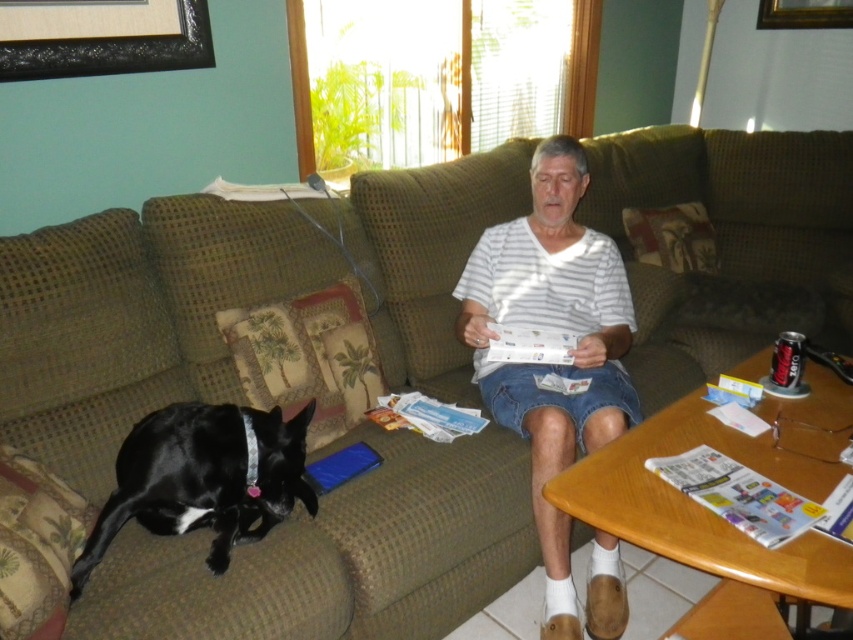
Question: Is black shiny dog at lower left above black matte picture frame at upper left?

Choices:
 (A) yes
 (B) no

Answer: (B)

Question: Considering the real-world distances, which object is closest to the white striped shirt at center?

Choices:
 (A) black shiny dog at lower left
 (B) gold wooden picture frame at upper right
 (C) black matte picture frame at upper left

Answer: (A)

Question: Is white striped shirt at center positioned behind black shiny dog at lower left?

Choices:
 (A) no
 (B) yes

Answer: (B)

Question: Which point is farther from the camera taking this photo?

Choices:
 (A) (65, 45)
 (B) (155, 461)

Answer: (A)

Question: In this image, where is white striped shirt at center located relative to gold wooden picture frame at upper right?

Choices:
 (A) right
 (B) left

Answer: (B)

Question: Which point is closer to the camera taking this photo?

Choices:
 (A) (144, 17)
 (B) (509, 416)
 (C) (846, 13)

Answer: (B)